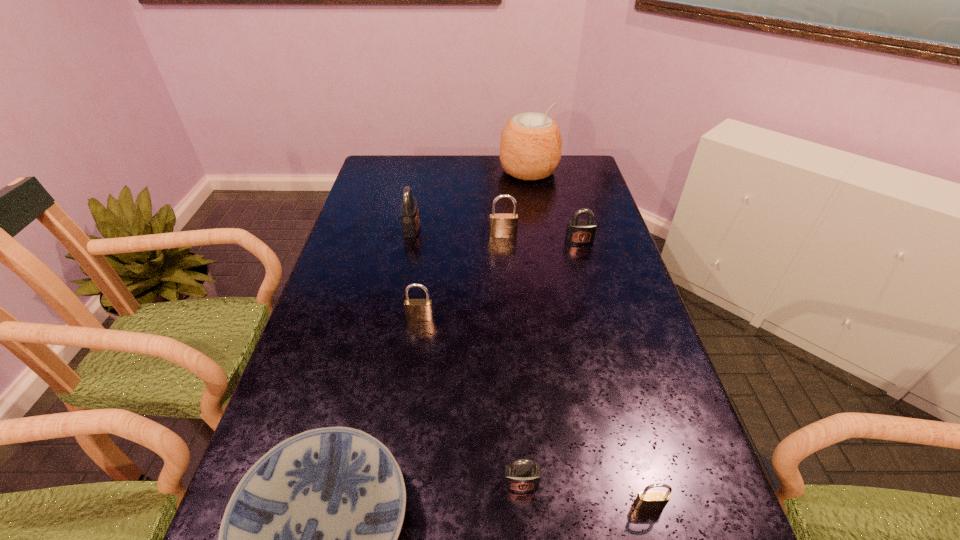
Find the location of a particular element. The image size is (960, 540). coconut is located at coordinates (530, 148).

Locate an element on the screen. Image resolution: width=960 pixels, height=540 pixels. the farthest object is located at coordinates (530, 148).

This screenshot has height=540, width=960. I want to click on the leftmost padlock, so click(409, 212).

Where is `the leftmost gray padlock`? the leftmost gray padlock is located at coordinates (409, 212).

You are a GUI agent. You are given a task and a screenshot of the screen. Output one action in this format:
    pyautogui.click(x=<x>, y=<y>)
    Task: Click on the biggest brass padlock
    
    Given the screenshot: What is the action you would take?
    pyautogui.click(x=501, y=225)

Locate an element on the screen. the farthest brass padlock is located at coordinates (501, 225).

You are a GUI agent. You are given a task and a screenshot of the screen. Output one action in this format:
    pyautogui.click(x=<x>, y=<y>)
    Task: Click on the second smallest gray padlock
    The height and width of the screenshot is (540, 960).
    Given the screenshot: What is the action you would take?
    pyautogui.click(x=579, y=232)

In order to click on the second smallest brass padlock in this screenshot , I will do `click(415, 309)`.

Where is `the second farthest brass padlock`? This screenshot has width=960, height=540. the second farthest brass padlock is located at coordinates (415, 309).

Where is `the nearest gray padlock`? the nearest gray padlock is located at coordinates (522, 475).